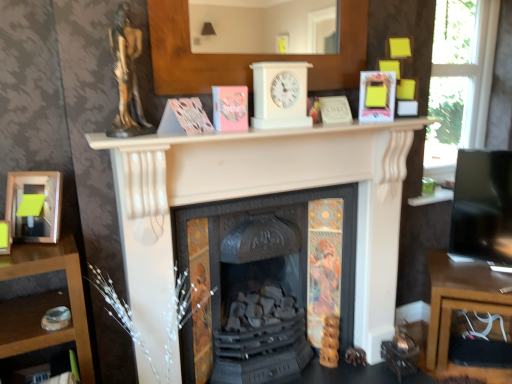
Question: Considering the relative positions of white matte fireplace at center, the 1th fireplace viewed from the front, and white plastic clock at center in the image provided, is white matte fireplace at center, the 1th fireplace viewed from the front, behind white plastic clock at center?

Choices:
 (A) no
 (B) yes

Answer: (A)

Question: From the image's perspective, is white matte fireplace at center, which is counted as the 2th fireplace, starting from the back, over white plastic clock at center?

Choices:
 (A) no
 (B) yes

Answer: (A)

Question: Is white matte fireplace at center, which is counted as the 2th fireplace, starting from the back, positioned before white plastic clock at center?

Choices:
 (A) no
 (B) yes

Answer: (B)

Question: Considering the relative sizes of white matte fireplace at center, which is counted as the 2th fireplace, starting from the back, and white plastic clock at center in the image provided, is white matte fireplace at center, which is counted as the 2th fireplace, starting from the back, shorter than white plastic clock at center?

Choices:
 (A) yes
 (B) no

Answer: (B)

Question: Could you tell me if white matte fireplace at center, the 1th fireplace viewed from the front, is turned towards white plastic clock at center?

Choices:
 (A) no
 (B) yes

Answer: (A)

Question: Is white matte fireplace at center, which is counted as the 2th fireplace, starting from the back, thinner than white plastic clock at center?

Choices:
 (A) yes
 (B) no

Answer: (B)

Question: Can we say matte white book at center, positioned as the third paperback book in left-to-right order, lies outside wooden desk at lower right?

Choices:
 (A) no
 (B) yes

Answer: (B)

Question: Are matte white book at center, positioned as the third paperback book in left-to-right order, and wooden desk at lower right located far from each other?

Choices:
 (A) no
 (B) yes

Answer: (B)

Question: From the image's perspective, would you say matte white book at center, marked as the second paperback book in a right-to-left arrangement, is shown under wooden desk at lower right?

Choices:
 (A) yes
 (B) no

Answer: (B)

Question: Considering the relative sizes of matte white book at center, marked as the second paperback book in a right-to-left arrangement, and wooden desk at lower right in the image provided, is matte white book at center, marked as the second paperback book in a right-to-left arrangement, taller than wooden desk at lower right?

Choices:
 (A) no
 (B) yes

Answer: (A)

Question: Is matte white book at center, marked as the second paperback book in a right-to-left arrangement, placed right next to wooden desk at lower right?

Choices:
 (A) yes
 (B) no

Answer: (B)

Question: Is matte white book at center, positioned as the third paperback book in left-to-right order, wider than wooden desk at lower right?

Choices:
 (A) no
 (B) yes

Answer: (A)

Question: Is transparent glass window at upper right next to pink matte paper at center, positioned as the 1th paperback book in left-to-right order, and touching it?

Choices:
 (A) no
 (B) yes

Answer: (A)